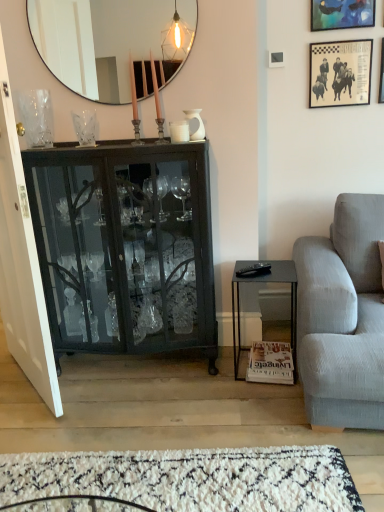
Question: From a real-world perspective, is white shag rug at lower center physically above black paper picture frame at upper right, the 2th picture frame from the left?

Choices:
 (A) yes
 (B) no

Answer: (B)

Question: Is white shag rug at lower center taller than black paper picture frame at upper right, which appears as the 2th picture frame when viewed from the right?

Choices:
 (A) yes
 (B) no

Answer: (B)

Question: Does white shag rug at lower center lie behind black paper picture frame at upper right, which appears as the 2th picture frame when viewed from the right?

Choices:
 (A) yes
 (B) no

Answer: (B)

Question: From the image's perspective, is white shag rug at lower center located beneath black paper picture frame at upper right, which appears as the 2th picture frame when viewed from the right?

Choices:
 (A) no
 (B) yes

Answer: (B)

Question: Does white shag rug at lower center appear on the left side of black paper picture frame at upper right, the 2th picture frame from the left?

Choices:
 (A) yes
 (B) no

Answer: (A)

Question: Can you confirm if white shag rug at lower center is smaller than black paper picture frame at upper right, which appears as the 2th picture frame when viewed from the right?

Choices:
 (A) no
 (B) yes

Answer: (A)

Question: Is white matte coffee cup at center smaller than matte black mirror at upper center?

Choices:
 (A) no
 (B) yes

Answer: (B)

Question: Does white matte coffee cup at center appear on the right side of matte black mirror at upper center?

Choices:
 (A) yes
 (B) no

Answer: (A)

Question: From a real-world perspective, is white matte coffee cup at center physically above matte black mirror at upper center?

Choices:
 (A) no
 (B) yes

Answer: (A)

Question: Is white matte coffee cup at center not within matte black mirror at upper center?

Choices:
 (A) yes
 (B) no

Answer: (A)

Question: From the image's perspective, is white matte coffee cup at center located beneath matte black mirror at upper center?

Choices:
 (A) yes
 (B) no

Answer: (A)

Question: Is white matte coffee cup at center looking in the opposite direction of matte black mirror at upper center?

Choices:
 (A) no
 (B) yes

Answer: (A)

Question: Is clear glass vase at upper center, the 2th vase when ordered from right to left, shorter than metallic blue painting at upper right, the first picture frame when ordered from left to right?

Choices:
 (A) yes
 (B) no

Answer: (A)